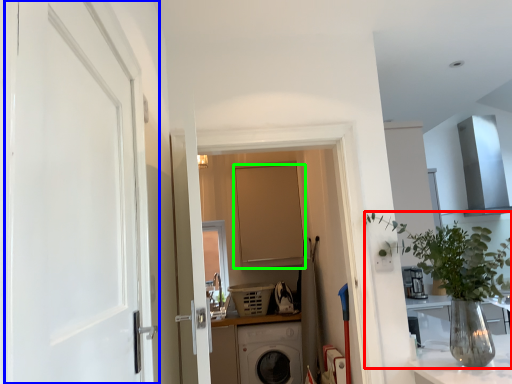
Question: Based on their relative distances, which object is nearer to houseplant (highlighted by a red box)? Choose from door (highlighted by a blue box) and door (highlighted by a green box).

Choices:
 (A) door
 (B) door

Answer: (A)